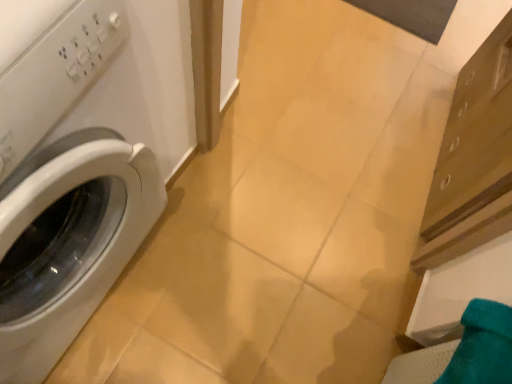
Where is `white glossy washing machine at left`? This screenshot has width=512, height=384. white glossy washing machine at left is located at coordinates (x=64, y=193).

In order to face white glossy washing machine at left, should I rotate leftwards or rightwards?

Turn left by 34.567 degrees to look at white glossy washing machine at left.

This screenshot has height=384, width=512. What do you see at coordinates (64, 193) in the screenshot? I see `white glossy washing machine at left` at bounding box center [64, 193].

The width and height of the screenshot is (512, 384). Find the location of `teal fabric towel at lower right`. teal fabric towel at lower right is located at coordinates [482, 346].

Describe the element at coordinates (482, 346) in the screenshot. I see `teal fabric towel at lower right` at that location.

What are the coordinates of `white glossy washing machine at left` in the screenshot? It's located at point(64,193).

Is teal fabric towel at lower right to the right of white glossy washing machine at left from the viewer's perspective?

Correct, you'll find teal fabric towel at lower right to the right of white glossy washing machine at left.

Considering their positions, is teal fabric towel at lower right located in front of or behind white glossy washing machine at left?

Visually, teal fabric towel at lower right is located behind white glossy washing machine at left.

Considering the points (449, 365) and (51, 198), which point is behind, point (449, 365) or point (51, 198)?

The point (449, 365) is more distant.

From the image's perspective, is teal fabric towel at lower right above or below white glossy washing machine at left?

teal fabric towel at lower right is situated lower than white glossy washing machine at left in the image.

From a real-world perspective, which object rests below the other?

teal fabric towel at lower right, from a real-world perspective.

Considering the sizes of teal fabric towel at lower right and white glossy washing machine at left in the image, is teal fabric towel at lower right wider or thinner than white glossy washing machine at left?

teal fabric towel at lower right is thinner than white glossy washing machine at left.

From their relative heights in the image, would you say teal fabric towel at lower right is taller or shorter than white glossy washing machine at left?

teal fabric towel at lower right is shorter than white glossy washing machine at left.

Considering the sizes of teal fabric towel at lower right and white glossy washing machine at left in the image, is teal fabric towel at lower right bigger or smaller than white glossy washing machine at left?

In the image, teal fabric towel at lower right appears to be smaller than white glossy washing machine at left.

Does teal fabric towel at lower right contain white glossy washing machine at left?

Definitely not — white glossy washing machine at left is not inside teal fabric towel at lower right.

Is there a large distance between teal fabric towel at lower right and white glossy washing machine at left?

That's not correct — teal fabric towel at lower right is a little close to white glossy washing machine at left.

Is white glossy washing machine at left at the back of teal fabric towel at lower right?

No.

Where is `washing machine above the teal fabric towel at lower right (from a real-world perspective)`? washing machine above the teal fabric towel at lower right (from a real-world perspective) is located at coordinates (64, 193).

Is white glossy washing machine at left to the left or to the right of teal fabric towel at lower right in the image?

Clearly, white glossy washing machine at left is on the left of teal fabric towel at lower right in the image.

In the scene shown: Is white glossy washing machine at left positioned in front of teal fabric towel at lower right?

Yes, the depth of white glossy washing machine at left is less than that of teal fabric towel at lower right.

Which is behind, point (81, 205) or point (487, 372)?

The point (81, 205) is behind.

From the image's perspective, which one is positioned lower, white glossy washing machine at left or teal fabric towel at lower right?

teal fabric towel at lower right, from the image's perspective.

From a real-world perspective, is white glossy washing machine at left under teal fabric towel at lower right?

No, from a real-world perspective, white glossy washing machine at left is not under teal fabric towel at lower right.

Which of these two, white glossy washing machine at left or teal fabric towel at lower right, is wider?

white glossy washing machine at left is wider.

Who is shorter, white glossy washing machine at left or teal fabric towel at lower right?

teal fabric towel at lower right.

Who is bigger, white glossy washing machine at left or teal fabric towel at lower right?

With larger size is white glossy washing machine at left.

Is white glossy washing machine at left inside or outside of teal fabric towel at lower right?

white glossy washing machine at left is located beyond the bounds of teal fabric towel at lower right.

Is white glossy washing machine at left far away from teal fabric towel at lower right?

Actually, white glossy washing machine at left and teal fabric towel at lower right are a little close together.

Could you tell me if white glossy washing machine at left is turned towards teal fabric towel at lower right?

Yes, white glossy washing machine at left is oriented towards teal fabric towel at lower right.

The height and width of the screenshot is (384, 512). In the image, there is a teal fabric towel at lower right. In order to click on washing machine above it (from the image's perspective) in this screenshot , I will do `click(64, 193)`.

At what (x,y) coordinates should I click in order to perform the action: click on bath towel on the right of the white glossy washing machine at left. Please return your answer as a coordinate pair (x, y). The height and width of the screenshot is (384, 512). Looking at the image, I should click on (482, 346).

Identify the location of washing machine above the teal fabric towel at lower right (from the image's perspective). (64, 193).